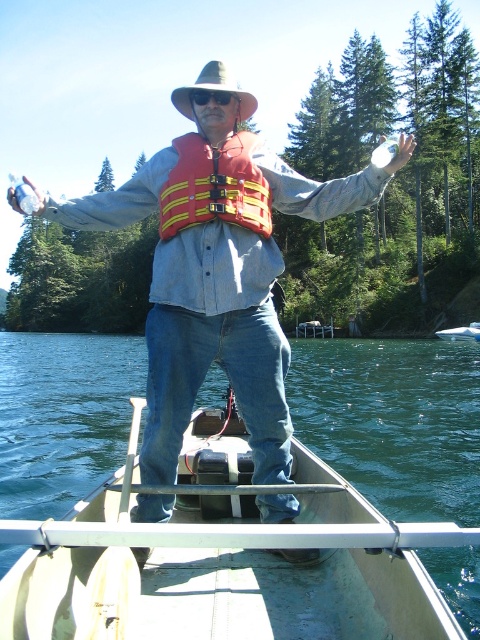
Can you confirm if red/yellow fabric life jacket at center is positioned to the left of brown felt cowboy hat at center?

In fact, red/yellow fabric life jacket at center is to the right of brown felt cowboy hat at center.

Between red/yellow fabric life jacket at center and brown felt cowboy hat at center, which one is positioned higher?

brown felt cowboy hat at center

Is point (172, 198) closer to camera compared to point (191, 108)?

Yes, point (172, 198) is closer to viewer.

Identify the location of red/yellow fabric life jacket at center. Image resolution: width=480 pixels, height=640 pixels. click(215, 186).

Is denim jeans at center above brown felt cowboy hat at center?

No.

Does point (135, 186) come farther from viewer compared to point (255, 100)?

Yes, it is.

Identify the location of denim jeans at center. The height and width of the screenshot is (640, 480). (217, 275).

Is denim jeans at center above red/yellow fabric life jacket at center?

Correct, denim jeans at center is located above red/yellow fabric life jacket at center.

Is point (210, 184) farther from viewer compared to point (240, 225)?

No.

At what (x,y) coordinates should I click in order to perform the action: click on denim jeans at center. Please return your answer as a coordinate pair (x, y). Looking at the image, I should click on (217, 275).